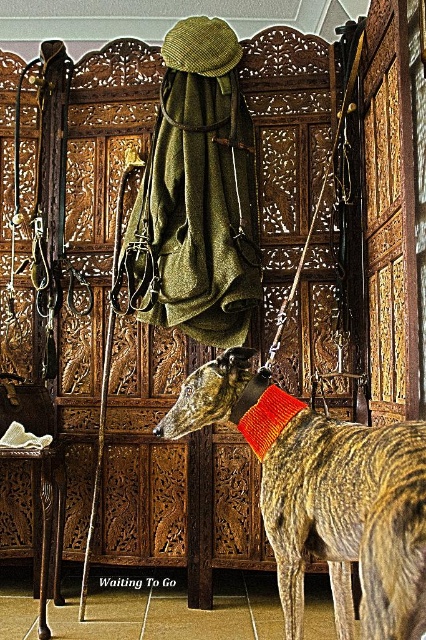
Can you confirm if striped fur dog at center is positioned above orange knitted neckband at center?

No, striped fur dog at center is not above orange knitted neckband at center.

In the scene shown: Is striped fur dog at center shorter than orange knitted neckband at center?

In fact, striped fur dog at center may be taller than orange knitted neckband at center.

Find the location of a particular element. striped fur dog at center is located at coordinates (325, 496).